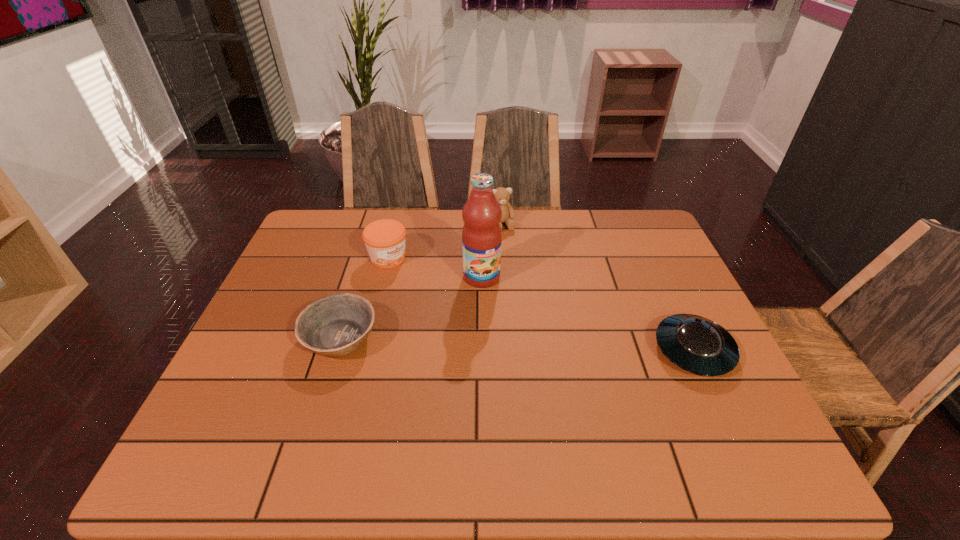
In order to click on free spot on the desktop that is between the bowl and the saucer and is positioned on the front label of the fruit juice in this screenshot , I will do `click(516, 345)`.

Locate an element on the screen. This screenshot has height=540, width=960. vacant space on the desktop that is between the bowl and the saucer and is positioned on the front label of the jam is located at coordinates (511, 344).

Identify the location of vacant space on the desktop that is between the bowl and the rightmost object and is positioned on the face of the farthest object. This screenshot has height=540, width=960. (556, 346).